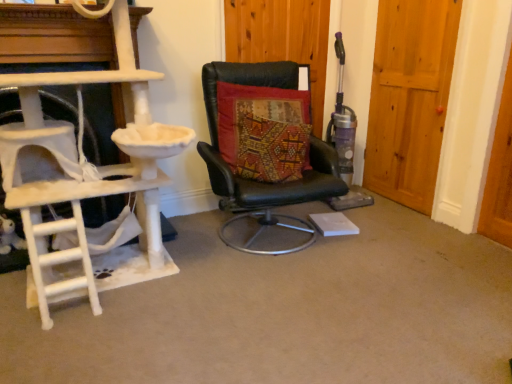
This screenshot has width=512, height=384. What are the coordinates of `vacant space underneath black leather chair at center (from a real-world perspective)` in the screenshot? It's located at (267, 234).